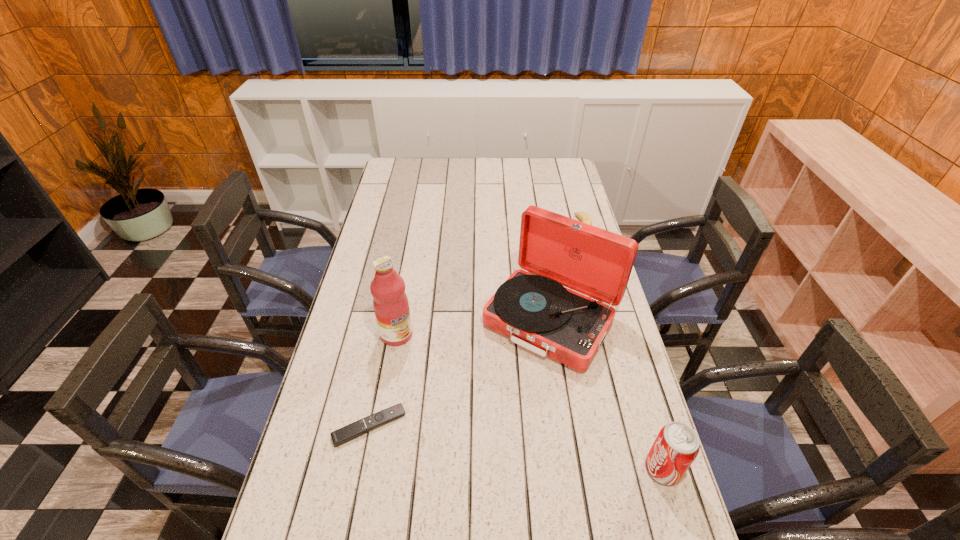
Image resolution: width=960 pixels, height=540 pixels. What are the coordinates of `vacant space on the desktop that is between the remote control and the nearest object and is positioned on the front-facing side of the phonograph_record` in the screenshot? It's located at (468, 440).

Identify the location of free space on the desktop that is between the remote control and the third tallest object and is positioned on the label of the fruit juice. The height and width of the screenshot is (540, 960). (489, 443).

I want to click on free spot on the desktop that is between the second nearest object and the soda can and is positioned at the stem of the second shortest object, so click(475, 441).